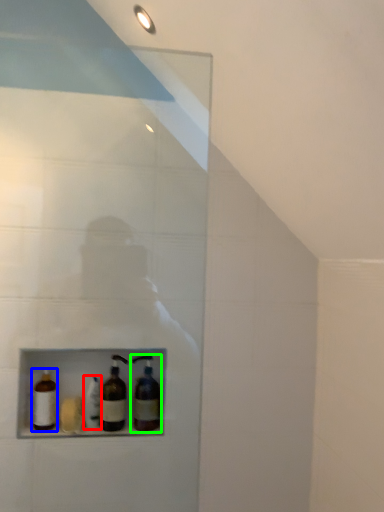
Question: Which object is positioned closest to bottle (highlighted by a red box)? Select from bottle (highlighted by a blue box) and bottle (highlighted by a green box).

Choices:
 (A) bottle
 (B) bottle

Answer: (A)